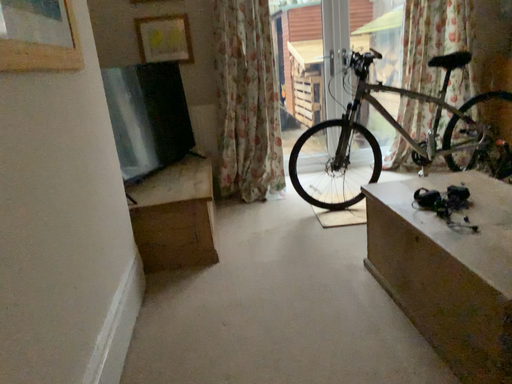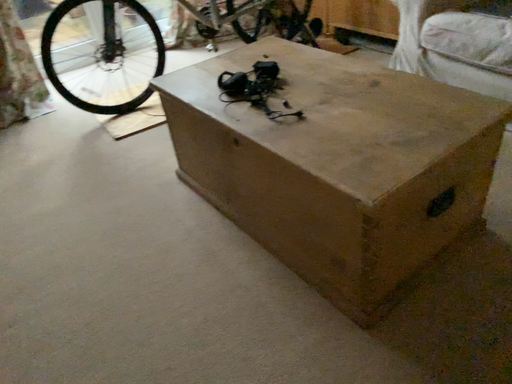
Question: How did the camera likely rotate when shooting the video?

Choices:
 (A) rotated upward
 (B) rotated downward

Answer: (B)